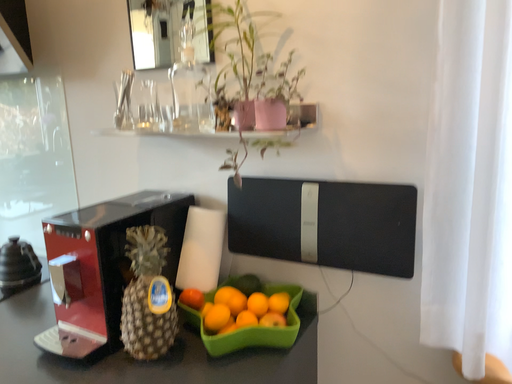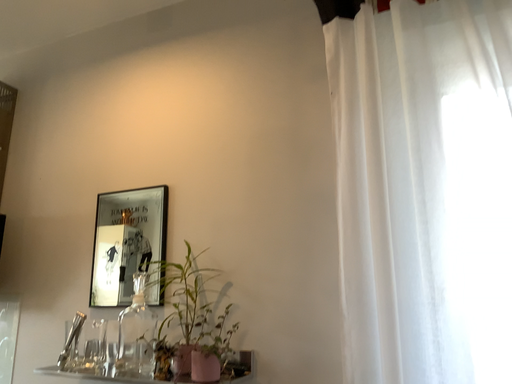
Question: How did the camera likely rotate when shooting the video?

Choices:
 (A) rotated downward
 (B) rotated upward

Answer: (B)